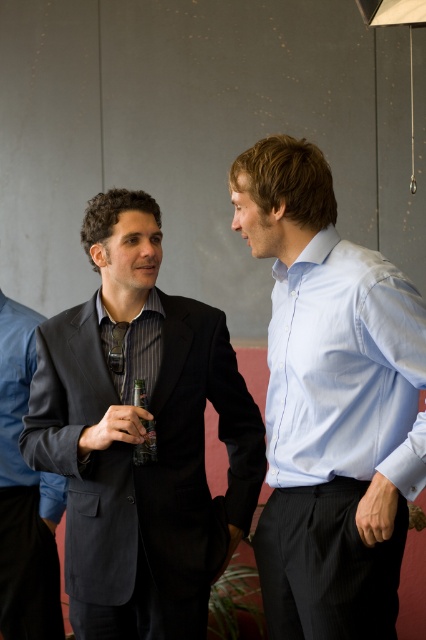
You are taking a photo of two people in an indoor setting. You notice two points in the image at coordinates point [230,401] and point [250,172]. Which point is closer to the camera?

Point [250,172] is closer to the camera than point [230,401].

You are taking a photo of two people in an indoor setting. You want to focus on the person on the left who is holding a beer bottle. However, you notice that the camera might be focusing on the other person on the right. Which point should you adjust the focus to ensure the left person is in focus? The points are point A at coordinate point [46,380] and point B at coordinate point [146,403]. Please choose between point A or point B.

You should focus on point A at coordinate point [46,380] because it is closer to the camera than point B at coordinate point [146,403]. Since the person on the left is closer, focusing on the closer point A will ensure they are in focus.

What are the coordinates of the light blue shirt at center?

The coordinates of the light blue shirt at center are at point (328, 403).